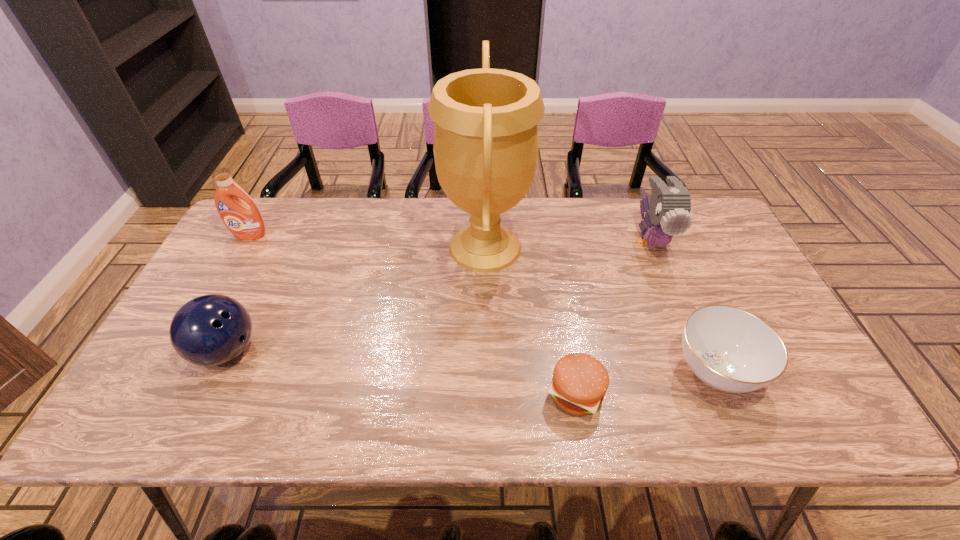
Identify the location of blank space located 0.240m at the beak of the bird. (688, 333).

You are a GUI agent. You are given a task and a screenshot of the screen. Output one action in this format:
    pyautogui.click(x=<x>, y=<y>)
    Task: Click on the free location located 0.200m on the surface of the fourth tallest object near the finger holes
    
    Given the screenshot: What is the action you would take?
    pyautogui.click(x=343, y=350)

Find the location of a particular element. The height and width of the screenshot is (540, 960). vacant space situated on the left of the second shortest object is located at coordinates (582, 370).

Where is `vacant space situated 0.240m on the left of the shortest object`? This screenshot has height=540, width=960. vacant space situated 0.240m on the left of the shortest object is located at coordinates (439, 393).

I want to click on trophy that is at the far edge, so click(485, 147).

Identify the location of detergent that is at the far edge. (243, 219).

Find the location of a particular element. The width and height of the screenshot is (960, 540). bird that is at the far edge is located at coordinates (668, 209).

This screenshot has height=540, width=960. I want to click on chinaware located in the near edge section of the desktop, so click(x=729, y=349).

Where is `hamburger located at the near edge`? The width and height of the screenshot is (960, 540). hamburger located at the near edge is located at coordinates [580, 381].

You are a GUI agent. You are given a task and a screenshot of the screen. Output one action in this format:
    pyautogui.click(x=<x>, y=<y>)
    Task: Click on the detergent that is positioned at the left edge
    The image size is (960, 540).
    Given the screenshot: What is the action you would take?
    243,219